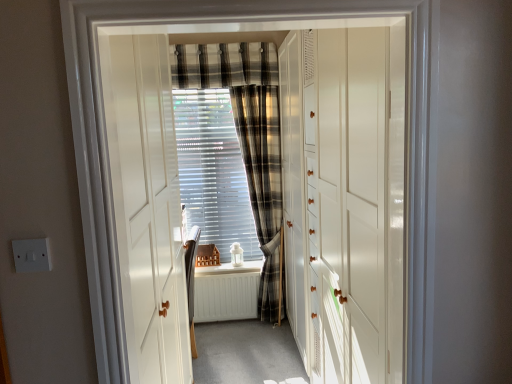
Measure the distance between white painted wood at center and camera.

white painted wood at center is 3.73 meters away from camera.

Measure the distance between white glossy cabinet at center, which is counted as the 1th door, starting from the back, and camera.

1.02 meters.

What is the approximate height of white glossy door at center, placed as the 2th door when sorted from back to front?

1.11 meters.

What do you see at coordinates (263, 183) in the screenshot? I see `plaid fabric curtain at center, positioned as the 1th curtain in bottom-to-top order` at bounding box center [263, 183].

This screenshot has width=512, height=384. What do you see at coordinates (213, 171) in the screenshot?
I see `translucent plastic blinds at center` at bounding box center [213, 171].

The image size is (512, 384). Identify the location of translucent plastic blinds at center. (213, 171).

You are a GUI agent. You are given a task and a screenshot of the screen. Output one action in this format:
    pyautogui.click(x=<x>, y=<y>)
    Task: Click on the white painted wood at center
    Image resolution: width=512 pixels, height=384 pixels.
    Given the screenshot: What is the action you would take?
    pyautogui.click(x=229, y=268)

Between white glossy cabinet at center, which is the second door from front to back, and white glossy door at center, placed as the 2th door when sorted from back to front, which one appears on the right side from the viewer's perspective?

white glossy cabinet at center, which is the second door from front to back, is more to the right.

From the image's perspective, is white glossy cabinet at center, which is counted as the 1th door, starting from the back, located above or below white glossy door at center, which ranks as the first door in front-to-back order?

From the image's perspective, white glossy cabinet at center, which is counted as the 1th door, starting from the back, appears below white glossy door at center, which ranks as the first door in front-to-back order.

From a real-world perspective, is white glossy cabinet at center, which is the second door from front to back, under white glossy door at center, which ranks as the first door in front-to-back order?

Indeed, from a real-world perspective, white glossy cabinet at center, which is the second door from front to back, is positioned beneath white glossy door at center, which ranks as the first door in front-to-back order.

Which of these two, white glossy cabinet at center, which is counted as the 1th door, starting from the back, or white glossy door at center, which ranks as the first door in front-to-back order, is wider?

white glossy cabinet at center, which is counted as the 1th door, starting from the back.

Considering the sizes of objects white glossy door at center, which ranks as the first door in front-to-back order, and translucent plastic blinds at center in the image provided, who is thinner, white glossy door at center, which ranks as the first door in front-to-back order, or translucent plastic blinds at center?

Thinner between the two is translucent plastic blinds at center.

From the image's perspective, does white glossy door at center, placed as the 2th door when sorted from back to front, appear lower than translucent plastic blinds at center?

Yes, from the image's perspective, white glossy door at center, placed as the 2th door when sorted from back to front, is beneath translucent plastic blinds at center.

Is white glossy door at center, placed as the 2th door when sorted from back to front, facing towards translucent plastic blinds at center?

No, white glossy door at center, placed as the 2th door when sorted from back to front, does not turn towards translucent plastic blinds at center.

In terms of width, does white glossy door at center, which ranks as the first door in front-to-back order, look wider or thinner when compared to plaid fabric curtain at upper center, which is the second curtain in bottom-to-top order?

white glossy door at center, which ranks as the first door in front-to-back order, is wider than plaid fabric curtain at upper center, which is the second curtain in bottom-to-top order.

Does white glossy door at center, which ranks as the first door in front-to-back order, have a lesser height compared to plaid fabric curtain at upper center, marked as the first curtain in a top-to-bottom arrangement?

Incorrect, the height of white glossy door at center, which ranks as the first door in front-to-back order, does not fall short of that of plaid fabric curtain at upper center, marked as the first curtain in a top-to-bottom arrangement.

Which object is positioned more to the left, white glossy door at center, placed as the 2th door when sorted from back to front, or plaid fabric curtain at upper center, marked as the first curtain in a top-to-bottom arrangement?

From the viewer's perspective, plaid fabric curtain at upper center, marked as the first curtain in a top-to-bottom arrangement, appears more on the left side.

Is point (269, 162) closer or farther from the camera than point (416, 229)?

Clearly, point (269, 162) is more distant from the camera than point (416, 229).

Which of these two, plaid fabric curtain at center, the second curtain when ordered from top to bottom, or white glossy door at center, placed as the 2th door when sorted from back to front, is bigger?

With larger size is white glossy door at center, placed as the 2th door when sorted from back to front.

Between plaid fabric curtain at center, the second curtain when ordered from top to bottom, and white painted wood at center, which one has less height?

With less height is white painted wood at center.

Is plaid fabric curtain at center, the second curtain when ordered from top to bottom, turned away from white painted wood at center?

No, plaid fabric curtain at center, the second curtain when ordered from top to bottom, is not facing away from white painted wood at center.

From a real-world perspective, between white matte radiator at center and white glossy door at center, placed as the 2th door when sorted from back to front, who is vertically higher?

From a 3D spatial view, white glossy door at center, placed as the 2th door when sorted from back to front, is above.

Considering the positions of objects white matte radiator at center and white glossy door at center, which ranks as the first door in front-to-back order, in the image provided, who is in front, white matte radiator at center or white glossy door at center, which ranks as the first door in front-to-back order,?

white glossy door at center, which ranks as the first door in front-to-back order, is more forward.

Is white matte radiator at center facing towards white glossy door at center, placed as the 2th door when sorted from back to front?

No, white matte radiator at center is not oriented towards white glossy door at center, placed as the 2th door when sorted from back to front.

Consider the image. Is white matte radiator at center placed right next to white glossy door at center, placed as the 2th door when sorted from back to front?

No, white matte radiator at center is not making contact with white glossy door at center, placed as the 2th door when sorted from back to front.

How different are the orientations of white plastic switch at lower left and translucent plastic blinds at center in degrees?

0.000894 degrees.

Does white plastic switch at lower left have a greater height compared to translucent plastic blinds at center?

In fact, white plastic switch at lower left may be shorter than translucent plastic blinds at center.

At what (x,y) coordinates should I click in order to perform the action: click on blind that is behind the white plastic switch at lower left. Please return your answer as a coordinate pair (x, y). The width and height of the screenshot is (512, 384). Looking at the image, I should click on (213, 171).

Consider the image. Which object is further away from the camera, white plastic switch at lower left or translucent plastic blinds at center?

Positioned behind is translucent plastic blinds at center.

Locate an element on the screen. Image resolution: width=512 pixels, height=384 pixels. door in front of the white glossy cabinet at center, which is the second door from front to back is located at coordinates (110, 171).

Locate an element on the screen. The image size is (512, 384). blind lying behind the white glossy door at center, placed as the 2th door when sorted from back to front is located at coordinates (213, 171).

Based on their spatial positions, is translucent plastic blinds at center or white glossy cabinet at center, which is counted as the 1th door, starting from the back, further from white painted wood at center?

white glossy cabinet at center, which is counted as the 1th door, starting from the back, is further to white painted wood at center.

Estimate the real-world distances between objects in this image. Which object is closer to white plastic switch at lower left, white glossy door at center, which ranks as the first door in front-to-back order, or plaid fabric curtain at center, positioned as the 1th curtain in bottom-to-top order?

white glossy door at center, which ranks as the first door in front-to-back order, lies closer to white plastic switch at lower left than the other object.

Which object lies further to the anchor point translucent plastic blinds at center, plaid fabric curtain at upper center, marked as the first curtain in a top-to-bottom arrangement, or white glossy door at center, placed as the 2th door when sorted from back to front?

white glossy door at center, placed as the 2th door when sorted from back to front, is further to translucent plastic blinds at center.

Estimate the real-world distances between objects in this image. Which object is closer to white glossy cabinet at center, which is the second door from front to back, translucent plastic blinds at center or white painted wood at center?

translucent plastic blinds at center is positioned closer to the anchor white glossy cabinet at center, which is the second door from front to back.

Estimate the real-world distances between objects in this image. Which object is further from plaid fabric curtain at upper center, which is the second curtain in bottom-to-top order, white painted wood at center or white glossy cabinet at center, which is counted as the 1th door, starting from the back?

Among the two, white painted wood at center is located further to plaid fabric curtain at upper center, which is the second curtain in bottom-to-top order.

Which object lies nearer to the anchor point white glossy cabinet at center, which is the second door from front to back, white painted wood at center or translucent plastic blinds at center?

translucent plastic blinds at center lies closer to white glossy cabinet at center, which is the second door from front to back, than the other object.

From the image, which object appears to be farther from plaid fabric curtain at upper center, which is the second curtain in bottom-to-top order, white painted wood at center or white plastic switch at lower left?

Based on the image, white plastic switch at lower left appears to be further to plaid fabric curtain at upper center, which is the second curtain in bottom-to-top order.

Estimate the real-world distances between objects in this image. Which object is further from white plastic switch at lower left, white glossy cabinet at center, which is counted as the 1th door, starting from the back, or white glossy door at center, which ranks as the first door in front-to-back order?

Among the two, white glossy cabinet at center, which is counted as the 1th door, starting from the back, is located further to white plastic switch at lower left.

This screenshot has width=512, height=384. Find the location of `door between white plastic switch at lower left and plaid fabric curtain at center, positioned as the 1th curtain in bottom-to-top order, along the z-axis`. door between white plastic switch at lower left and plaid fabric curtain at center, positioned as the 1th curtain in bottom-to-top order, along the z-axis is located at coordinates (345, 199).

Where is `blind between white glossy door at center, which ranks as the first door in front-to-back order, and white painted wood at center, along the z-axis`? blind between white glossy door at center, which ranks as the first door in front-to-back order, and white painted wood at center, along the z-axis is located at coordinates (213, 171).

Image resolution: width=512 pixels, height=384 pixels. Identify the location of radiator between white plastic switch at lower left and white painted wood at center along the z-axis. (226, 296).

The height and width of the screenshot is (384, 512). Find the location of `electric outlet located between white glossy door at center, placed as the 2th door when sorted from back to front, and white painted wood at center in the depth direction`. electric outlet located between white glossy door at center, placed as the 2th door when sorted from back to front, and white painted wood at center in the depth direction is located at coordinates (32, 255).